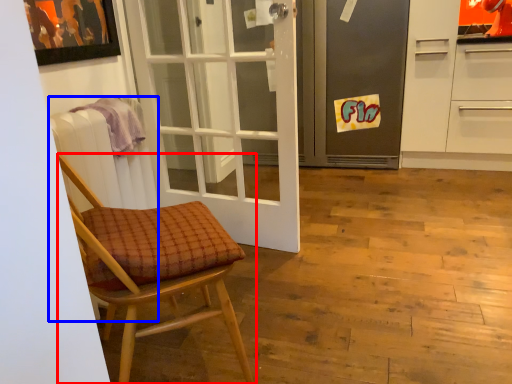
Question: Which of the following is the farthest to the observer, chair (highlighted by a red box) or radiator (highlighted by a blue box)?

Choices:
 (A) chair
 (B) radiator

Answer: (B)